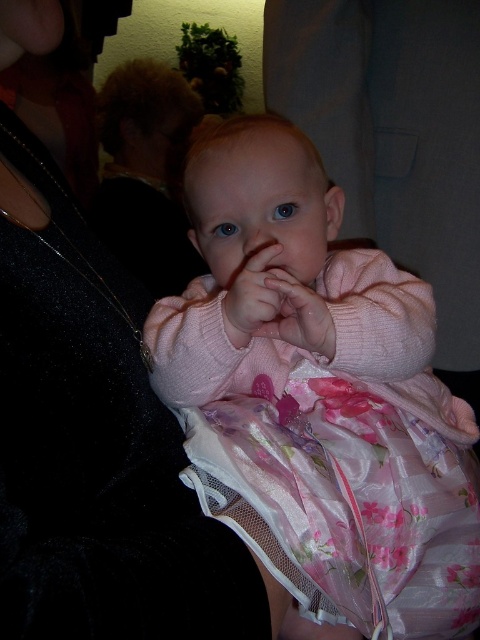
Does pink satin dress at center lie behind matte black dress at upper left?

Yes, pink satin dress at center is further from the viewer.

Which is behind, point (229, 186) or point (129, 529)?

The point (229, 186) is behind.

Is point (192, 468) less distant than point (98, 320)?

No, it is behind (98, 320).

I want to click on pink satin dress at center, so click(321, 403).

Which is above, matte black dress at upper left or blonde hair at upper left?

blonde hair at upper left is higher up.

Who is more forward, (49, 579) or (131, 218)?

Point (49, 579)

Between point (115, 428) and point (164, 112), which one is positioned behind?

The point (164, 112) is more distant.

The height and width of the screenshot is (640, 480). I want to click on matte black dress at upper left, so click(x=95, y=445).

Consider the image. Who is taller, matte black dress at upper left or pink soft fabric hand at center?

Standing taller between the two is matte black dress at upper left.

Between matte black dress at upper left and pink soft fabric hand at center, which one appears on the right side from the viewer's perspective?

From the viewer's perspective, pink soft fabric hand at center appears more on the right side.

Locate an element on the screen. This screenshot has width=480, height=640. matte black dress at upper left is located at coordinates (95, 445).